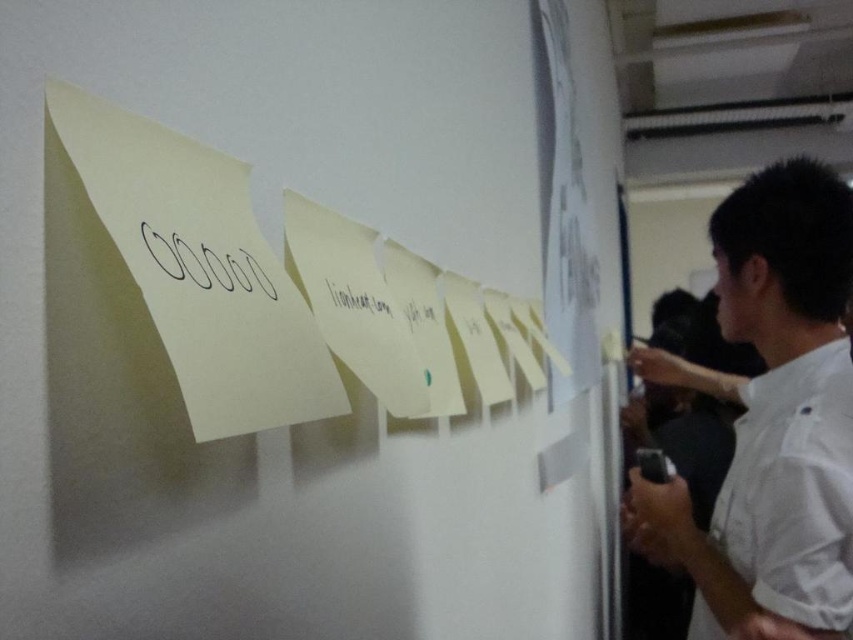
Based on the scene description, can the person wearing the white shirt at right comfortably hold the black paper at center without overlapping it with other objects?

The white shirt at right might be wider than black paper at center, so it is possible that the person can hold the black paper at center without overlapping it with other objects, but there is uncertainty due to the comparative width.

You are standing at the camera position and want to hand a document to the person wearing the white shirt at right. Can you reach them without moving from your current position?

The distance between the white shirt at right and the camera is 37.16 inches, which is approximately 3.1 feet. Since this distance is within typical reaching range for most adults, you can likely hand the document to the person wearing the white shirt at right without moving from your current position.

You are standing at the point marked as point (502, 241). You need to reach the whiteboard. Is there enough space to move forward without bumping into the people around you?

The distance between you and the whiteboard is 1.10 meters, which should be sufficient to move forward without bumping into others, assuming a typical walking space of about 0.9 meters.